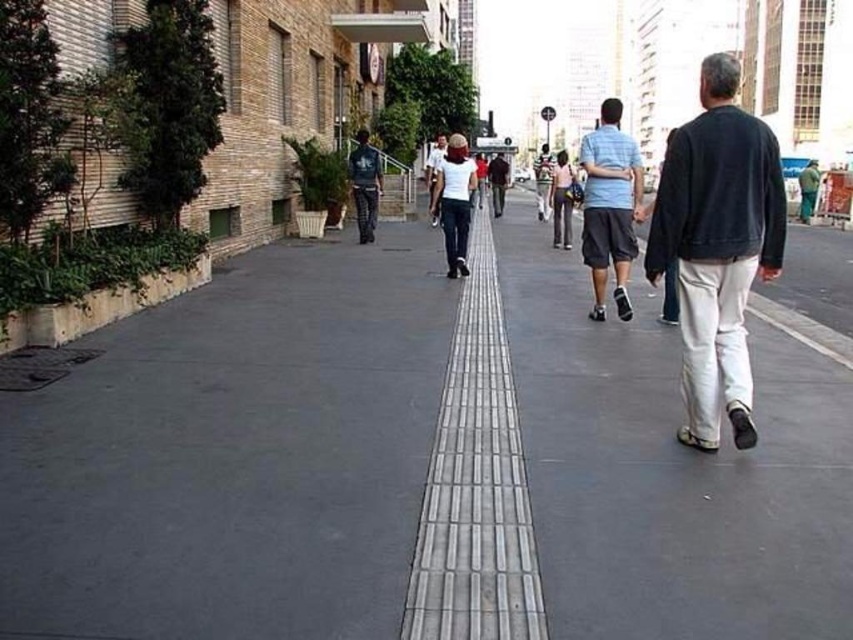
Is light blue striped shirt at center bigger than white cotton shirt at center?

Incorrect, light blue striped shirt at center is not larger than white cotton shirt at center.

Which of these two, light blue striped shirt at center or white cotton shirt at center, stands taller?

Standing taller between the two is white cotton shirt at center.

Find the location of a particular element. Image resolution: width=853 pixels, height=640 pixels. light blue striped shirt at center is located at coordinates (608, 205).

Identify the location of light blue striped shirt at center. Image resolution: width=853 pixels, height=640 pixels. (608, 205).

Who is higher up, dark blue fleece jacket at right or white shirt at center?

white shirt at center is higher up.

Does dark blue fleece jacket at right appear on the right side of white shirt at center?

Correct, you'll find dark blue fleece jacket at right to the right of white shirt at center.

Is point (691, 234) positioned before point (432, 145)?

Yes, point (691, 234) is in front of point (432, 145).

I want to click on dark blue fleece jacket at right, so click(x=717, y=246).

Is dark blue fleece jacket at right smaller than light blue striped shirt at center?

Indeed, dark blue fleece jacket at right has a smaller size compared to light blue striped shirt at center.

Between point (715, 120) and point (590, 228), which one is positioned in front?

Positioned in front is point (715, 120).

Is point (747, 352) positioned behind point (601, 147)?

No.

Find the location of a particular element. Image resolution: width=853 pixels, height=640 pixels. dark blue fleece jacket at right is located at coordinates (717, 246).